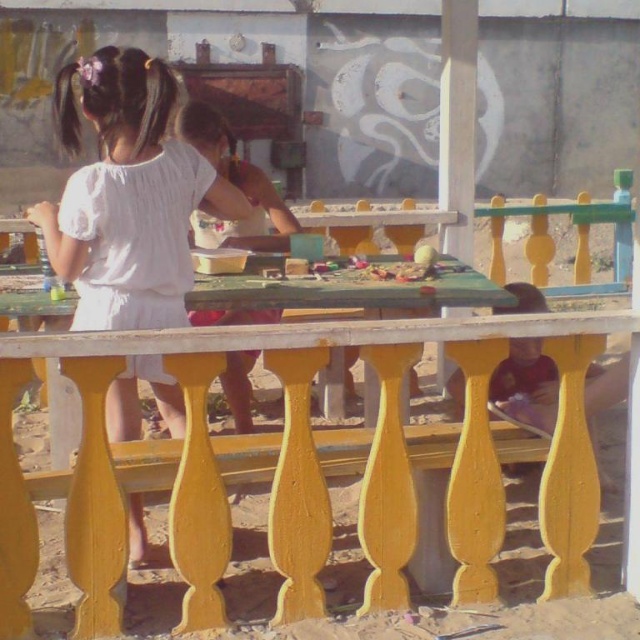
You are standing at the center of the image and want to place a new decorative item exactly where the white cotton dress at center is located. What are the coordinates where you should place the item?

The coordinates for the white cotton dress at center are at point (128, 195), so you should place the decorative item there.

You are a photographer setting up a shoot at this location. You need to place a 3ft wide mannequin wearing a white cotton dress at center on the yellow painted wood table at center. Will the mannequin fit on the table?

The white cotton dress at center has a width less than the yellow painted wood table at center, so the mannequin should fit on the table as the table is wider than the dress.

You are a photographer setting up a shoot in this outdoor area. You need to position a 1.5m tall mannequin wearing a white cotton dress at center and a yellow painted wood table at center. According to the scene, which object should be placed lower to ensure the mannequin and table align with the original image?

The yellow painted wood table at center should be placed lower because the white cotton dress at center is taller than the table in the original scene.